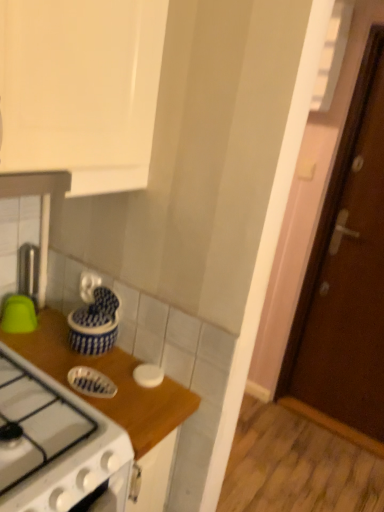
I want to click on free region on the left part of white matte lid at center, the fourth kitchen appliance viewed from the left, so click(x=101, y=364).